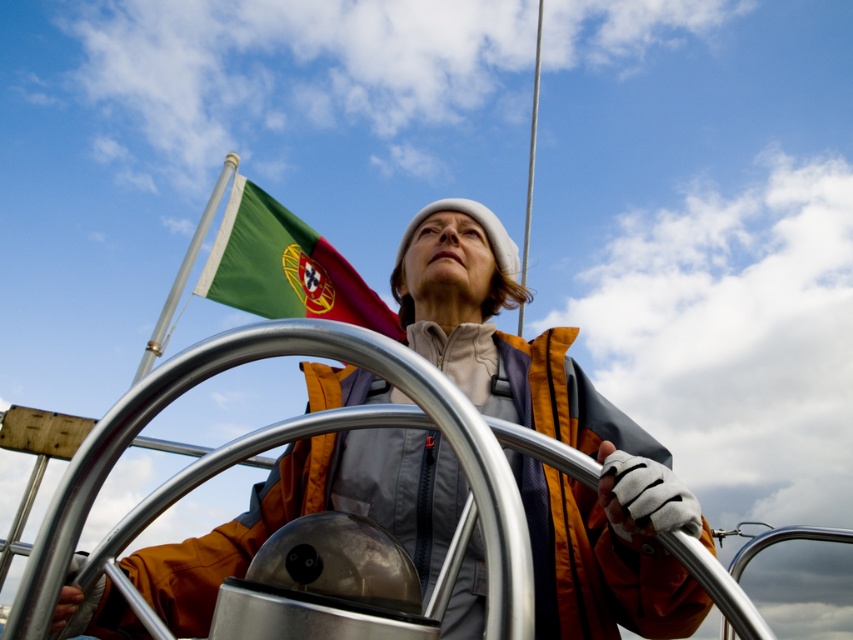
Between orange fabric jacket at center and green fabric flag at upper left, which one is positioned lower?

orange fabric jacket at center

What do you see at coordinates (550, 436) in the screenshot? Image resolution: width=853 pixels, height=640 pixels. I see `orange fabric jacket at center` at bounding box center [550, 436].

In the scene shown: Who is more forward, [666,572] or [296,291]?

Point [666,572]

The image size is (853, 640). What are the coordinates of `orange fabric jacket at center` in the screenshot? It's located at (550, 436).